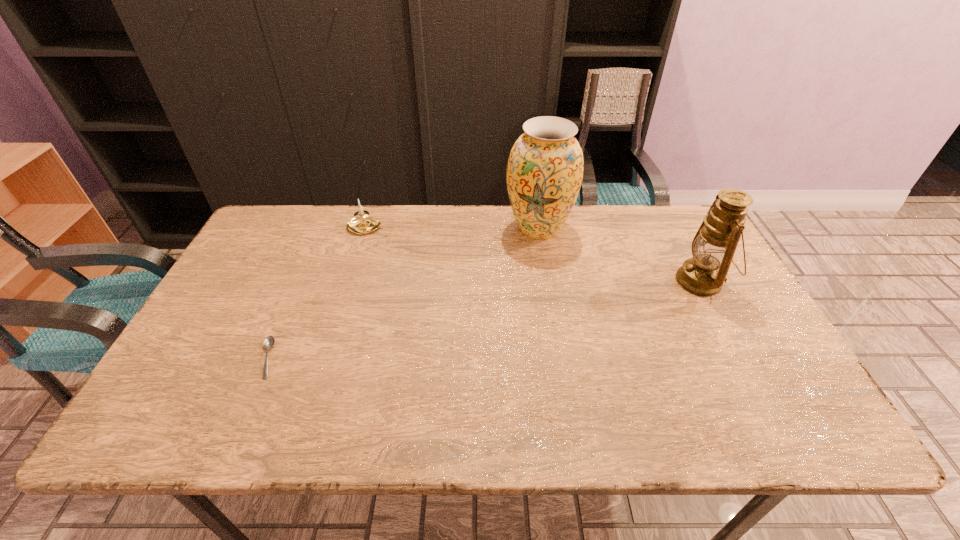
This screenshot has width=960, height=540. Find the location of `vase`. vase is located at coordinates (544, 174).

This screenshot has height=540, width=960. Find the location of `the third shortest object`. the third shortest object is located at coordinates (713, 247).

You are a GUI agent. You are given a task and a screenshot of the screen. Output one action in this format:
    pyautogui.click(x=<x>, y=<y>)
    Task: Click on the oil lamp
    The image size is (960, 540).
    Given the screenshot: What is the action you would take?
    pyautogui.click(x=713, y=247)

At what (x,y) coordinates should I click in order to perform the action: click on the second object from left to right. Please return your answer as a coordinate pair (x, y). This screenshot has width=960, height=540. Looking at the image, I should click on (361, 224).

You are a GUI agent. You are given a task and a screenshot of the screen. Output one action in this format:
    pyautogui.click(x=<x>, y=<y>)
    Task: Click on the third tallest object
    This screenshot has height=540, width=960.
    Given the screenshot: What is the action you would take?
    pyautogui.click(x=361, y=224)

The image size is (960, 540). I want to click on soupspoon, so click(269, 341).

Where is `the nearest object`? the nearest object is located at coordinates (269, 341).

What are the coordinates of `vacant space located on the right of the third object from left to right` in the screenshot? It's located at (622, 228).

The image size is (960, 540). Identify the location of free space located on the back of the oil lamp. (660, 205).

Where is `vacant space located 0.330m on the handle side of the second shortest object`? The image size is (960, 540). vacant space located 0.330m on the handle side of the second shortest object is located at coordinates (487, 227).